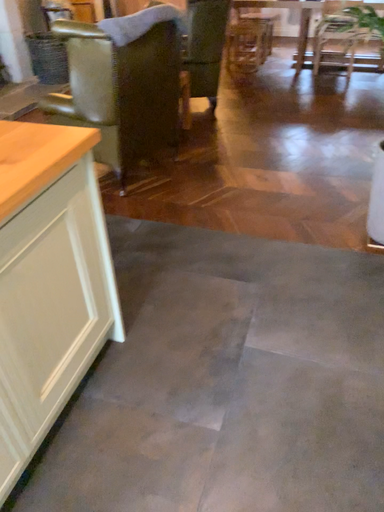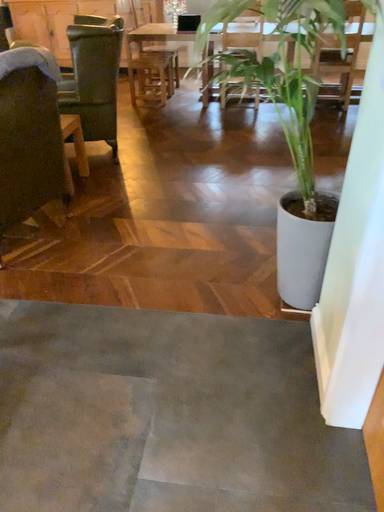
Question: How did the camera likely rotate when shooting the video?

Choices:
 (A) rotated left
 (B) rotated right

Answer: (B)